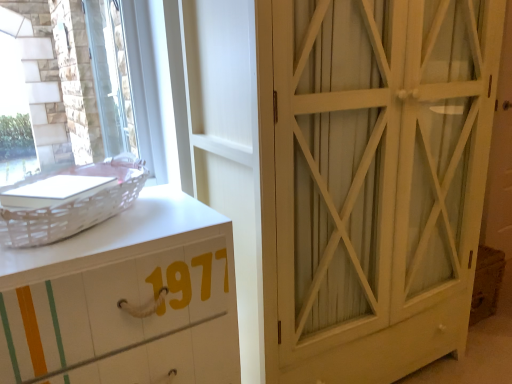
Looking at this image, what is the approximate width of white wood cabinet at right?

white wood cabinet at right is 58.66 centimeters in width.

This screenshot has height=384, width=512. What do you see at coordinates (126, 299) in the screenshot?
I see `white painted wood chest of drawers at left` at bounding box center [126, 299].

Measure the distance between white painted wood chest of drawers at left and camera.

85.90 centimeters.

What is the approximate height of clear glass window at upper left?

The height of clear glass window at upper left is 24.96 inches.

Image resolution: width=512 pixels, height=384 pixels. I want to click on white wood cabinet at right, so click(371, 180).

From the image's perspective, which one is positioned higher, white painted wood chest of drawers at left or white wood cabinet at right?

white wood cabinet at right.

Is white painted wood chest of drawers at left in front of or behind white wood cabinet at right in the image?

white painted wood chest of drawers at left is positioned closer to the viewer than white wood cabinet at right.

Which of these two, white painted wood chest of drawers at left or white wood cabinet at right, is thinner?

white painted wood chest of drawers at left.

Considering the positions of point (154, 244) and point (415, 269), is point (154, 244) closer or farther from the camera than point (415, 269)?

Clearly, point (154, 244) is closer to the camera than point (415, 269).

Which object is closer to the camera, white wicker basket at left or clear glass window at upper left?

white wicker basket at left is in front.

From the image's perspective, is white wicker basket at left below clear glass window at upper left?

Indeed, from the image's perspective, white wicker basket at left is shown beneath clear glass window at upper left.

Locate an element on the screen. window above the white wicker basket at left (from a real-world perspective) is located at coordinates tap(116, 81).

Can you confirm if white wicker basket at left is bigger than clear glass window at upper left?

No, white wicker basket at left is not bigger than clear glass window at upper left.

From the picture: Is clear glass window at upper left a part of white wood cabinet at right?

No.

In the scene shown: Considering the sizes of objects white wood cabinet at right and clear glass window at upper left in the image provided, who is thinner, white wood cabinet at right or clear glass window at upper left?

With smaller width is clear glass window at upper left.

Where is `window that is above the white wood cabinet at right (from a real-world perspective)`? The image size is (512, 384). window that is above the white wood cabinet at right (from a real-world perspective) is located at coordinates (116, 81).

Considering the relative positions of white wood cabinet at right and clear glass window at upper left in the image provided, is white wood cabinet at right to the left or to the right of clear glass window at upper left?

In the image, white wood cabinet at right appears on the right side of clear glass window at upper left.

Is clear glass window at upper left wider than white painted wood chest of drawers at left?

Incorrect, the width of clear glass window at upper left does not surpass that of white painted wood chest of drawers at left.

Who is shorter, clear glass window at upper left or white painted wood chest of drawers at left?

Standing shorter between the two is clear glass window at upper left.

Is clear glass window at upper left at the right side of white painted wood chest of drawers at left?

No, clear glass window at upper left is not to the right of white painted wood chest of drawers at left.

Which object is thinner, white wood cabinet at right or white wicker basket at left?

white wicker basket at left.

Is white wicker basket at left at the back of white wood cabinet at right?

No, white wood cabinet at right is not facing away from white wicker basket at left.

From a real-world perspective, between white wood cabinet at right and white wicker basket at left, who is vertically lower?

white wood cabinet at right, from a real-world perspective.

Between white wood cabinet at right and white wicker basket at left, which one has more height?

Standing taller between the two is white wood cabinet at right.

In the scene shown: Considering the positions of objects white painted wood chest of drawers at left and white wicker basket at left in the image provided, who is more to the left, white painted wood chest of drawers at left or white wicker basket at left?

white wicker basket at left.

Is white painted wood chest of drawers at left smaller than white wicker basket at left?

No.

Could you tell me if white painted wood chest of drawers at left is facing white wicker basket at left?

No, white painted wood chest of drawers at left is not facing towards white wicker basket at left.

From a real-world perspective, is white painted wood chest of drawers at left below white wicker basket at left?

Yes, from a real-world perspective, white painted wood chest of drawers at left is below white wicker basket at left.

Is white wood cabinet at right at the left side of white painted wood chest of drawers at left?

No.

Is white wood cabinet at right bigger than white painted wood chest of drawers at left?

Correct, white wood cabinet at right is larger in size than white painted wood chest of drawers at left.

From the image's perspective, is white wood cabinet at right located beneath white painted wood chest of drawers at left?

No, from the image's perspective, white wood cabinet at right is not below white painted wood chest of drawers at left.

Would you consider white wood cabinet at right to be distant from white painted wood chest of drawers at left?

They are positioned close to each other.

The image size is (512, 384). Identify the location of the chest of drawers located underneath the white wood cabinet at right (from a real-world perspective). (126, 299).

You are a GUI agent. You are given a task and a screenshot of the screen. Output one action in this format:
    pyautogui.click(x=<x>, y=<y>)
    Task: Click on the basket that is on the right side of clear glass window at upper left
    
    Given the screenshot: What is the action you would take?
    pyautogui.click(x=76, y=205)

Looking at the image, which one is located closer to clear glass window at upper left, white wood cabinet at right or white painted wood chest of drawers at left?

white wood cabinet at right is positioned closer to the anchor clear glass window at upper left.

Which object lies further to the anchor point white wicker basket at left, white painted wood chest of drawers at left or white wood cabinet at right?

Among the two, white wood cabinet at right is located further to white wicker basket at left.

Based on their spatial positions, is white wicker basket at left or white wood cabinet at right closer to white painted wood chest of drawers at left?

white wicker basket at left.

When comparing their distances from clear glass window at upper left, does white wicker basket at left or white painted wood chest of drawers at left seem closer?

The object closer to clear glass window at upper left is white wicker basket at left.

Looking at the image, which one is located further to white wicker basket at left, white wood cabinet at right or white painted wood chest of drawers at left?

white wood cabinet at right lies further to white wicker basket at left than the other object.

Which object lies further to the anchor point white wicker basket at left, white wood cabinet at right or clear glass window at upper left?

clear glass window at upper left is further to white wicker basket at left.

From the image, which object appears to be farther from clear glass window at upper left, white painted wood chest of drawers at left or white wood cabinet at right?

The object further to clear glass window at upper left is white painted wood chest of drawers at left.

When comparing their distances from white wicker basket at left, does clear glass window at upper left or white wood cabinet at right seem closer?

white wood cabinet at right is positioned closer to the anchor white wicker basket at left.

Locate an element on the screen. This screenshot has width=512, height=384. chest of drawers between white wicker basket at left and white wood cabinet at right in the horizontal direction is located at coordinates (126, 299).

Where is `basket located between clear glass window at upper left and white wood cabinet at right in the left-right direction`? The image size is (512, 384). basket located between clear glass window at upper left and white wood cabinet at right in the left-right direction is located at coordinates (76, 205).

Identify the location of basket between clear glass window at upper left and white painted wood chest of drawers at left from top to bottom. The height and width of the screenshot is (384, 512). (76, 205).

Locate an element on the screen. Image resolution: width=512 pixels, height=384 pixels. the chest of drawers located between clear glass window at upper left and white wood cabinet at right in the left-right direction is located at coordinates (126, 299).